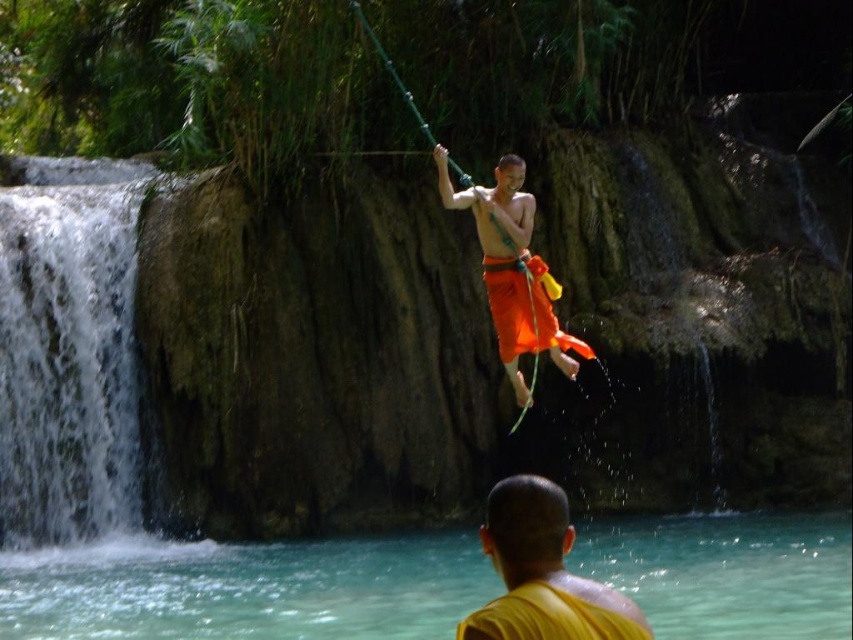
Question: Among these points, which one is nearest to the camera?

Choices:
 (A) (541, 349)
 (B) (33, 172)
 (C) (618, 576)

Answer: (A)

Question: Which of these objects is positioned farthest from the clear turquoise water at lower center?

Choices:
 (A) white frothy water at left
 (B) orange fabric at center
 (C) yellow matte monk at lower center

Answer: (B)

Question: Can you confirm if clear turquoise water at lower center is positioned to the right of orange fabric at center?

Choices:
 (A) no
 (B) yes

Answer: (A)

Question: Does clear turquoise water at lower center appear over white frothy water at left?

Choices:
 (A) yes
 (B) no

Answer: (B)

Question: Does clear turquoise water at lower center appear under orange fabric at center?

Choices:
 (A) yes
 (B) no

Answer: (A)

Question: Which of the following is the closest to the observer?

Choices:
 (A) clear turquoise water at lower center
 (B) yellow matte monk at lower center
 (C) white frothy water at left

Answer: (B)